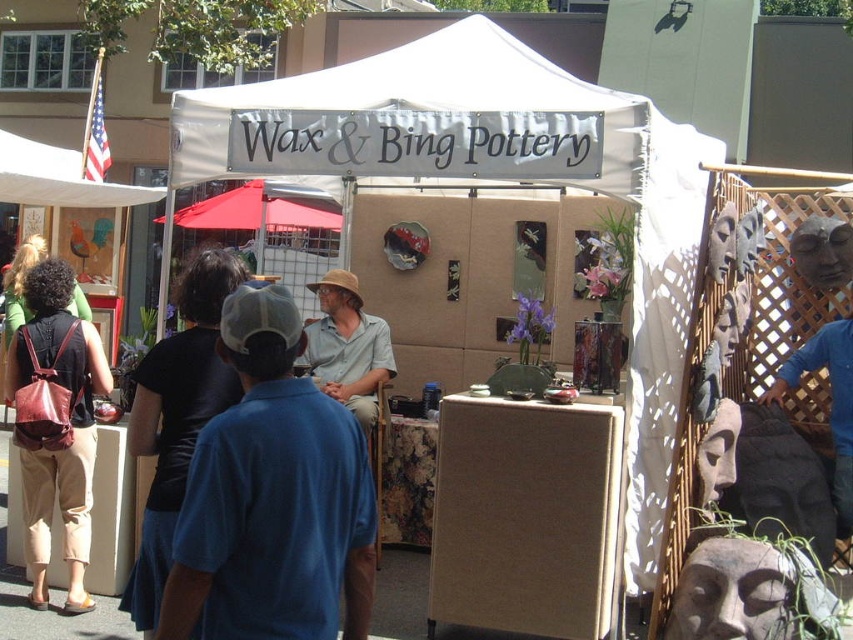
Which is more to the right, blue cotton shirt at center or brown leather backpack at left?

From the viewer's perspective, blue cotton shirt at center appears more on the right side.

Which is in front, point (334, 545) or point (44, 412)?

Positioned in front is point (334, 545).

Is point (247, 314) closer to viewer compared to point (93, 422)?

Yes, it is in front of point (93, 422).

Locate an element on the screen. The height and width of the screenshot is (640, 853). blue cotton shirt at center is located at coordinates (271, 497).

Is blue cotton shirt at center bigger than white fabric canopy at upper left?

Incorrect, blue cotton shirt at center is not larger than white fabric canopy at upper left.

Who is more distant from viewer, (x=273, y=417) or (x=27, y=156)?

The point (x=27, y=156) is more distant.

I want to click on blue cotton shirt at center, so click(x=271, y=497).

Which is behind, point (387, 333) or point (292, 195)?

The point (292, 195) is more distant.

Is matte khaki shirt at center in front of red fabric canopy at upper center?

Yes, matte khaki shirt at center is closer to the viewer.

The height and width of the screenshot is (640, 853). What do you see at coordinates (347, 346) in the screenshot? I see `matte khaki shirt at center` at bounding box center [347, 346].

Where is `matte khaki shirt at center`? This screenshot has width=853, height=640. matte khaki shirt at center is located at coordinates (347, 346).